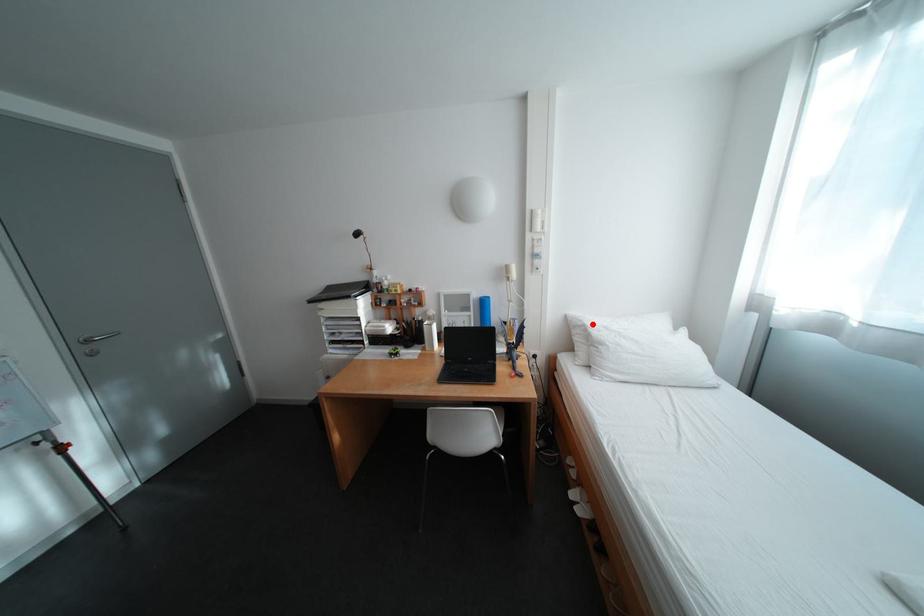
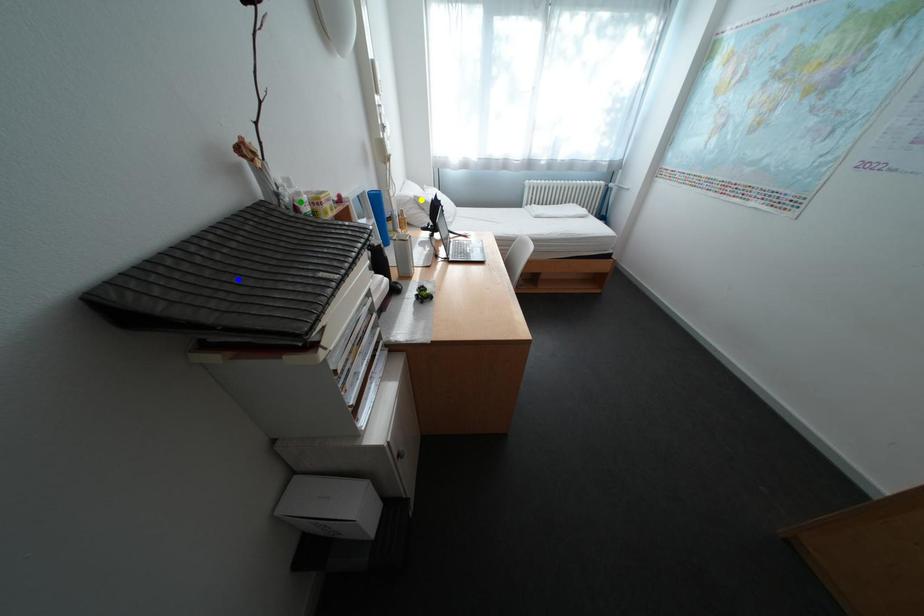
Question: I am providing you with two images of the same scene from different viewpoints. A red point is marked on the first image. You are given multiple points on the second image. Which mark in image 2 goes with the point in image 1?

Choices:
 (A) green point
 (B) yellow point
 (C) blue point

Answer: (B)